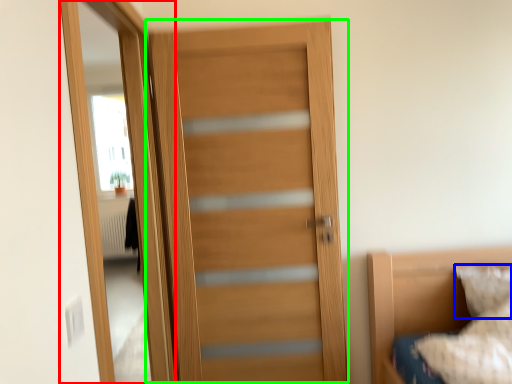
Question: Which is nearer to the screen door (highlighted by a red box)? pillow (highlighted by a blue box) or door (highlighted by a green box).

Choices:
 (A) pillow
 (B) door

Answer: (B)